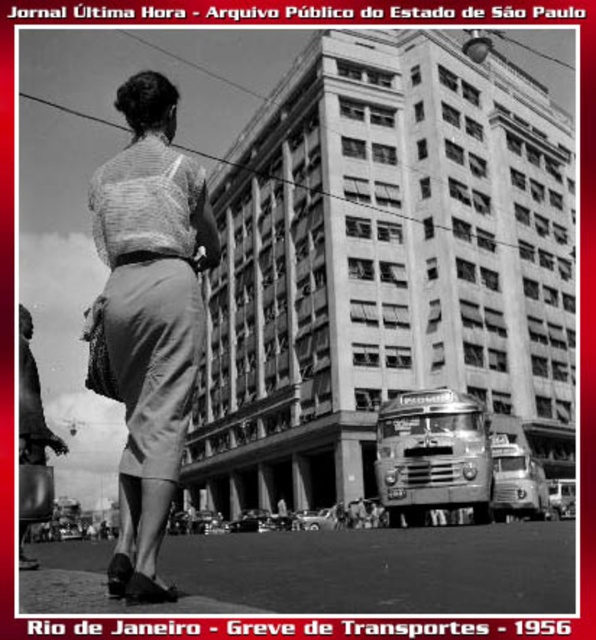
You are a photographer trying to capture a photo of the matte gray skirt at center and the matte gray skirt at lower left in the scene. The camera you are using has a maximum focus range of 30 feet. Can you capture both skirts in focus without moving the camera?

The matte gray skirt at center and the matte gray skirt at lower left are 36.13 feet apart from each other. Since the camera can only focus within 30 feet, the distance between them exceeds the maximum focus range. Therefore, you cannot capture both skirts in focus without moving the camera.